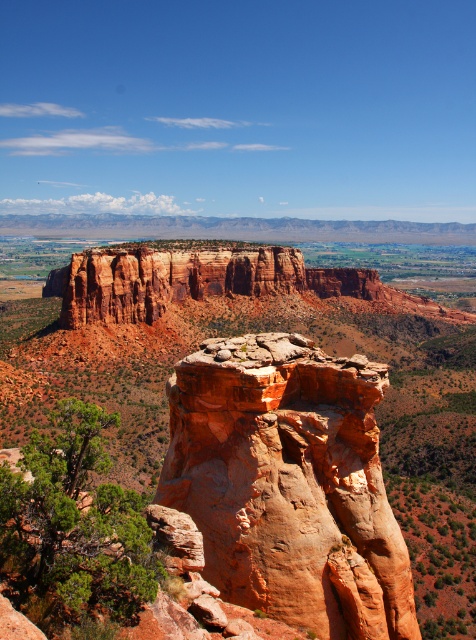
Question: Is rustic sandstone canyon at center to the left of rustic sandstone rock formation at center from the viewer's perspective?

Choices:
 (A) yes
 (B) no

Answer: (A)

Question: Does rustic sandstone canyon at center come in front of rustic sandstone rock formation at center?

Choices:
 (A) no
 (B) yes

Answer: (A)

Question: Is rustic sandstone canyon at center further to the viewer compared to rustic sandstone rock formation at center?

Choices:
 (A) no
 (B) yes

Answer: (B)

Question: Which point is closer to the camera?

Choices:
 (A) rustic sandstone rock formation at center
 (B) rustic sandstone canyon at center

Answer: (A)

Question: Among these points, which one is farthest from the camera?

Choices:
 (A) (253, 449)
 (B) (90, 381)

Answer: (B)